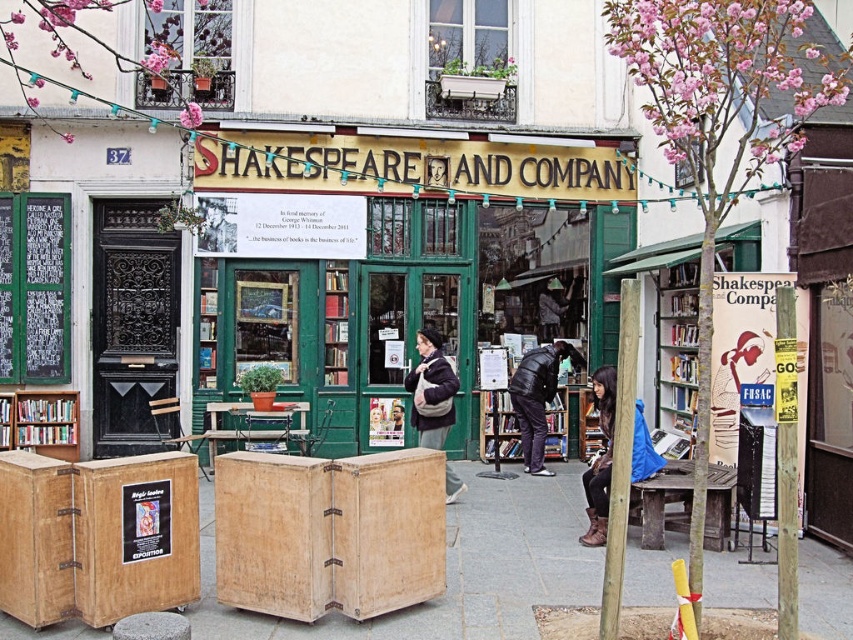
Question: Which object is the closest to the leather boots at lower right?

Choices:
 (A) black puffy jacket at center
 (B) white paper poster at center right

Answer: (B)

Question: Which object is farther from the camera taking this photo?

Choices:
 (A) smooth wooden pole at center
 (B) wooden bookshelf at left

Answer: (B)

Question: From the image, what is the correct spatial relationship of smooth wooden pole at center in relation to matte black coat at center?

Choices:
 (A) right
 (B) left

Answer: (A)

Question: Is wooden crates at center below white paper poster at center right?

Choices:
 (A) no
 (B) yes

Answer: (B)

Question: Can you confirm if smooth wooden pole at center is positioned to the right of wooden bookshelf at left?

Choices:
 (A) no
 (B) yes

Answer: (B)

Question: Which point is closer to the camera?

Choices:
 (A) smooth wooden pole at center
 (B) black puffy jacket at center
 (C) white paper poster at center right
 (D) matte black coat at center

Answer: (A)